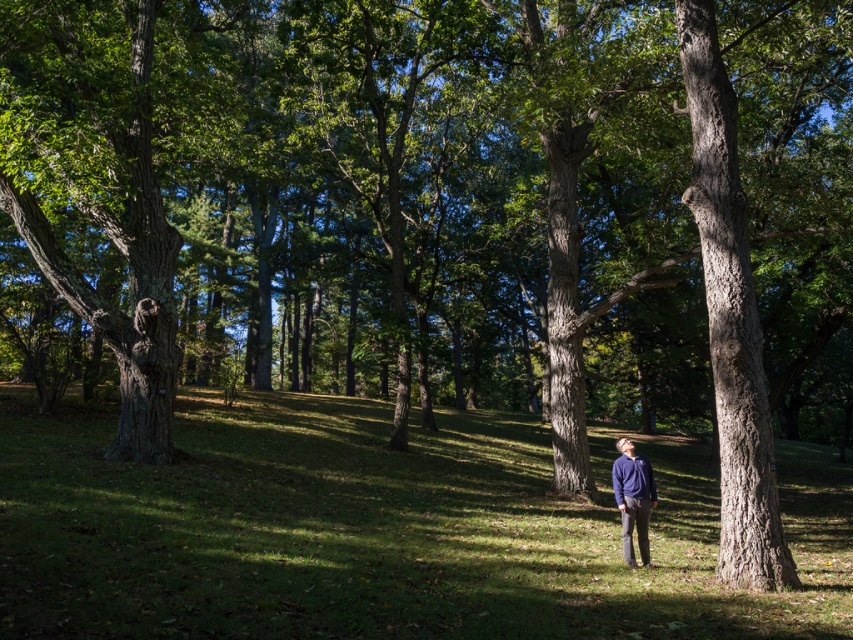
Does green grass at center have a lesser width compared to matte blue sweater at center?

In fact, green grass at center might be wider than matte blue sweater at center.

Who is more distant from viewer, (97, 620) or (619, 445)?

Point (619, 445)

Identify the location of green grass at center. This screenshot has height=640, width=853. point(381,529).